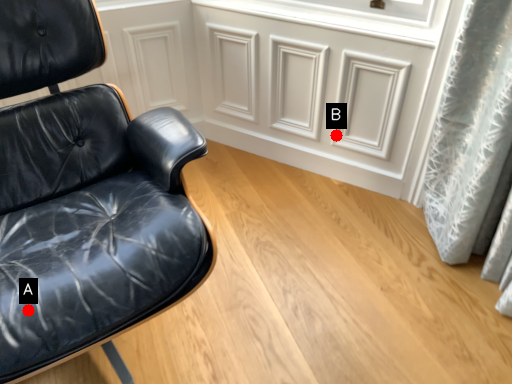
Question: Two points are circled on the image, labeled by A and B beside each circle. Among these points, which one is farthest from the camera?

Choices:
 (A) A is further
 (B) B is further

Answer: (B)